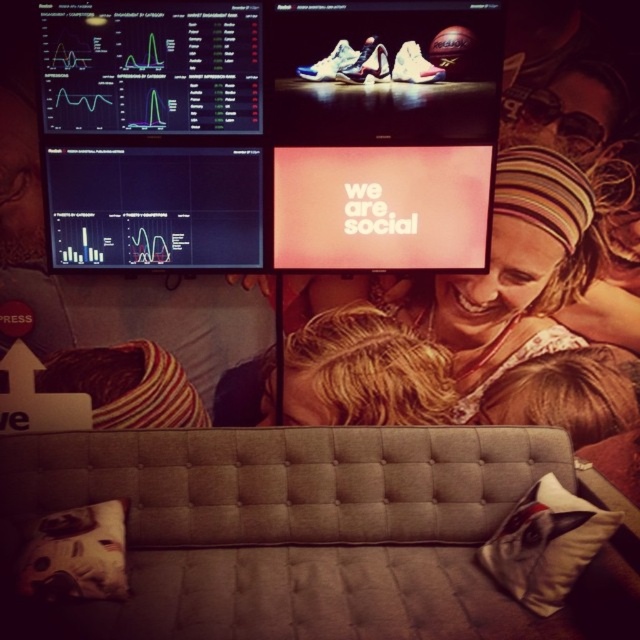
Can you confirm if matte plastic screen at upper center is wider than tufted fabric couch at lower center?

No.

Which is above, matte plastic screen at upper center or tufted fabric couch at lower center?

matte plastic screen at upper center is above.

The width and height of the screenshot is (640, 640). What do you see at coordinates (269, 132) in the screenshot?
I see `matte plastic screen at upper center` at bounding box center [269, 132].

I want to click on matte plastic screen at upper center, so click(269, 132).

How far apart are tufted fabric couch at lower center and white fabric pillow at lower left?

The distance of tufted fabric couch at lower center from white fabric pillow at lower left is 13.04 inches.

Find the location of a particular element. tufted fabric couch at lower center is located at coordinates (301, 532).

Is point (404, 538) less distant than point (44, 582)?

No, (404, 538) is behind (44, 582).

I want to click on tufted fabric couch at lower center, so click(x=301, y=532).

Which is below, tufted fabric couch at lower center or matte pink headband at center?

Positioned lower is tufted fabric couch at lower center.

Can you confirm if tufted fabric couch at lower center is smaller than matte pink headband at center?

Incorrect, tufted fabric couch at lower center is not smaller in size than matte pink headband at center.

Find the location of `tufted fabric couch at lower center`. tufted fabric couch at lower center is located at coordinates (301, 532).

Locate an element on the screen. tufted fabric couch at lower center is located at coordinates (301, 532).